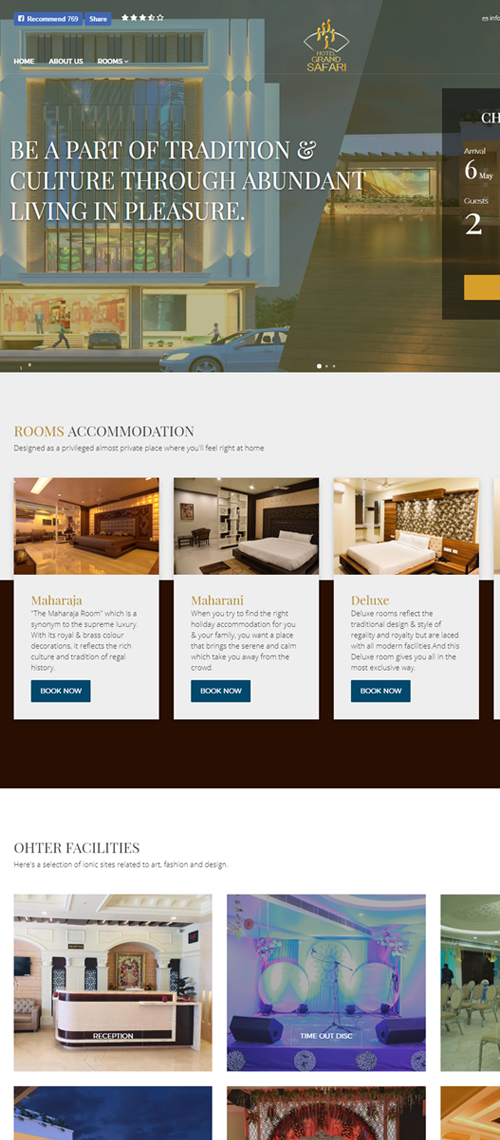
Where is `desk`? Image resolution: width=500 pixels, height=1140 pixels. desk is located at coordinates (110, 1013).